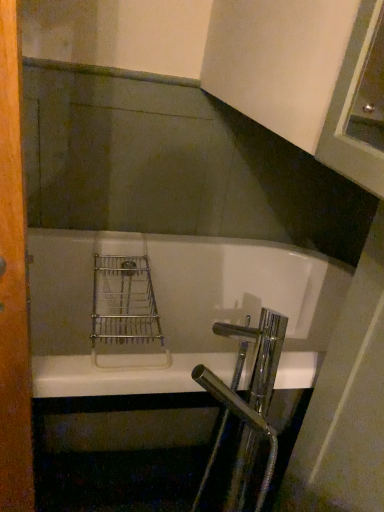
Question: From the image's perspective, is white glossy bathtub at center above or below wooden screen door at left?

Choices:
 (A) below
 (B) above

Answer: (A)

Question: Is point (281, 368) positioned closer to the camera than point (13, 250)?

Choices:
 (A) farther
 (B) closer

Answer: (A)

Question: Is white glossy bathtub at center wider or thinner than wooden screen door at left?

Choices:
 (A) thin
 (B) wide

Answer: (B)

Question: In terms of size, does wooden screen door at left appear bigger or smaller than white glossy bathtub at center?

Choices:
 (A) small
 (B) big

Answer: (A)

Question: Considering the positions of wooden screen door at left and white glossy bathtub at center in the image, is wooden screen door at left taller or shorter than white glossy bathtub at center?

Choices:
 (A) tall
 (B) short

Answer: (A)

Question: In the image, is wooden screen door at left positioned in front of or behind white glossy bathtub at center?

Choices:
 (A) behind
 (B) front

Answer: (B)

Question: From the image's perspective, is wooden screen door at left above or below white glossy bathtub at center?

Choices:
 (A) above
 (B) below

Answer: (A)